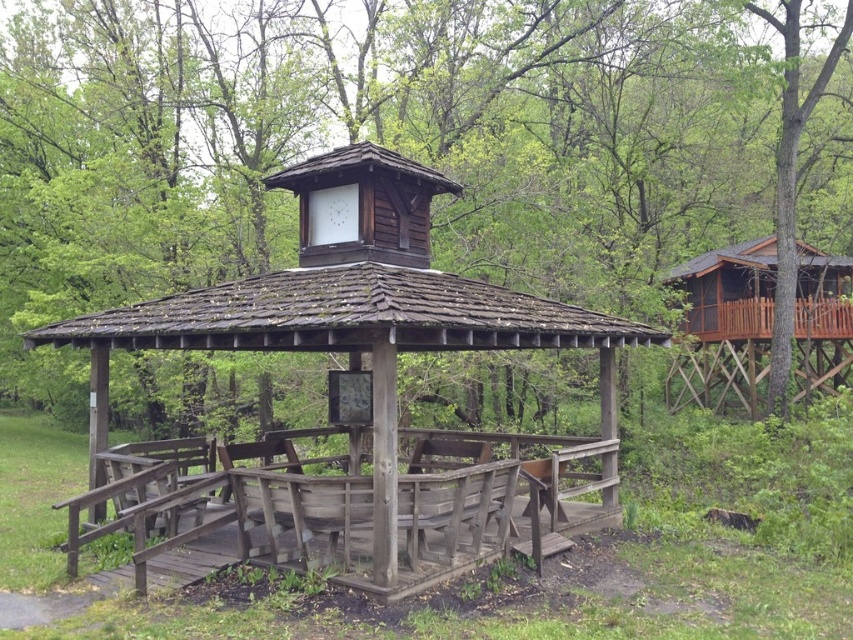
You are planning to host a small gathering for 10 people. The brown wooden gazebo at center and the wooden cabin at right are both available. Which location can comfortably accommodate everyone?

The brown wooden gazebo at center is larger in size than the wooden cabin at right, so it can comfortably accommodate a gathering of 10 people.

You are planning to set up a small stage for a community event. The stage requires a space that is wider than the weathered wood gazebo at center. Can the brown wooden gazebo at center accommodate this requirement?

The brown wooden gazebo at center might be wider than the weathered wood gazebo at center, so it could potentially accommodate the stage if its width meets the requirement.